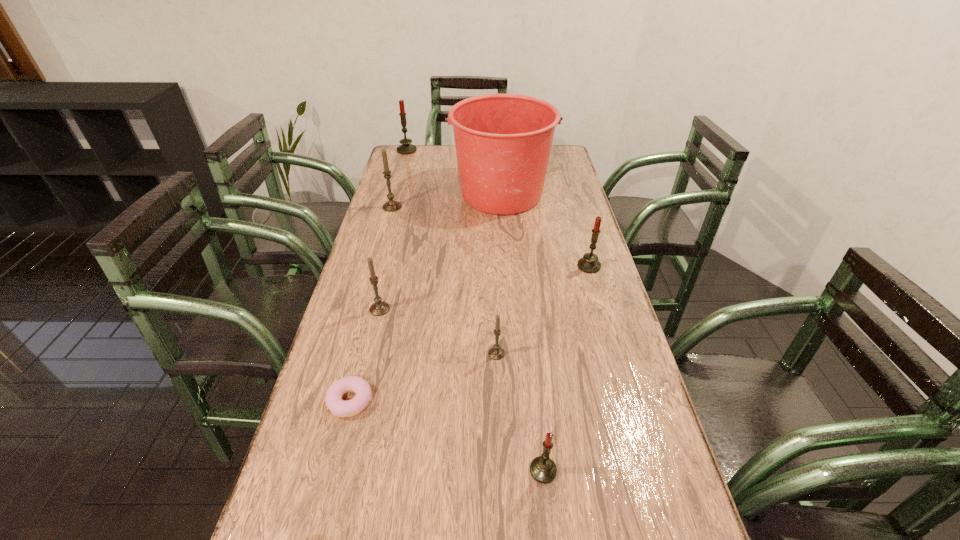
The image size is (960, 540). I want to click on the smallest red candle, so click(x=542, y=469).

This screenshot has width=960, height=540. What are the coordinates of `the nearest candle` in the screenshot? It's located at pos(542,469).

The width and height of the screenshot is (960, 540). I want to click on the smallest gray candle, so point(496,353).

The image size is (960, 540). Identify the location of the nearest gray candle. (496, 353).

Find the location of a particular element. The height and width of the screenshot is (540, 960). the shortest object is located at coordinates (333, 399).

Find the location of `doughnut`. doughnut is located at coordinates (333, 399).

You are a GUI agent. You are given a task and a screenshot of the screen. Output one action in this format:
    pyautogui.click(x=<x>, y=<y>)
    Task: Click on the vacant space located on the front of the tallest object
    Image resolution: width=960 pixels, height=540 pixels.
    Given the screenshot: What is the action you would take?
    pyautogui.click(x=509, y=298)

Image resolution: width=960 pixels, height=540 pixels. What are the coordinates of `vacant space located on the right of the farthest object` in the screenshot? It's located at (453, 150).

The width and height of the screenshot is (960, 540). I want to click on vacant space positioned on the front of the biggest gray candle, so click(388, 223).

This screenshot has width=960, height=540. What are the coordinates of `vacant space situated 0.120m on the front of the second biggest red candle` in the screenshot? It's located at (599, 301).